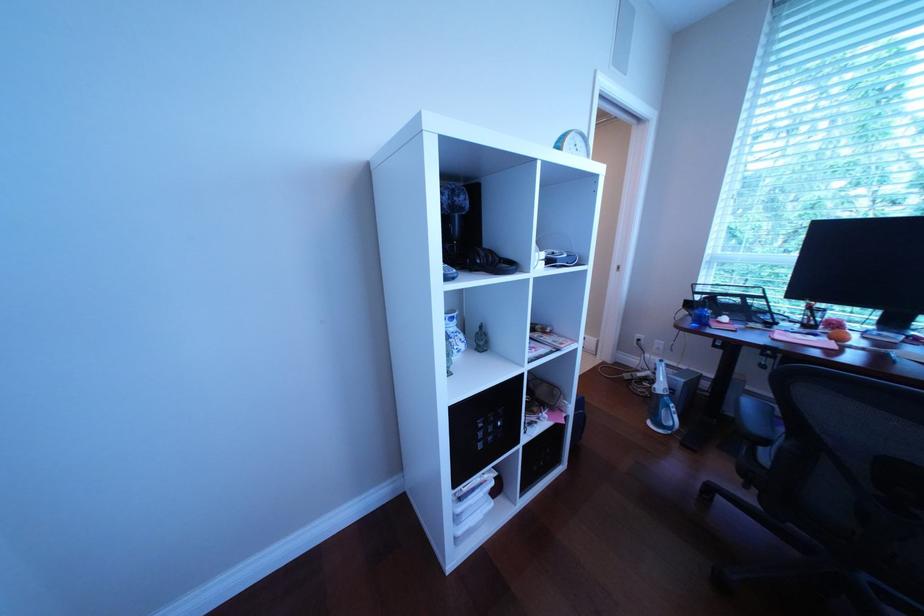
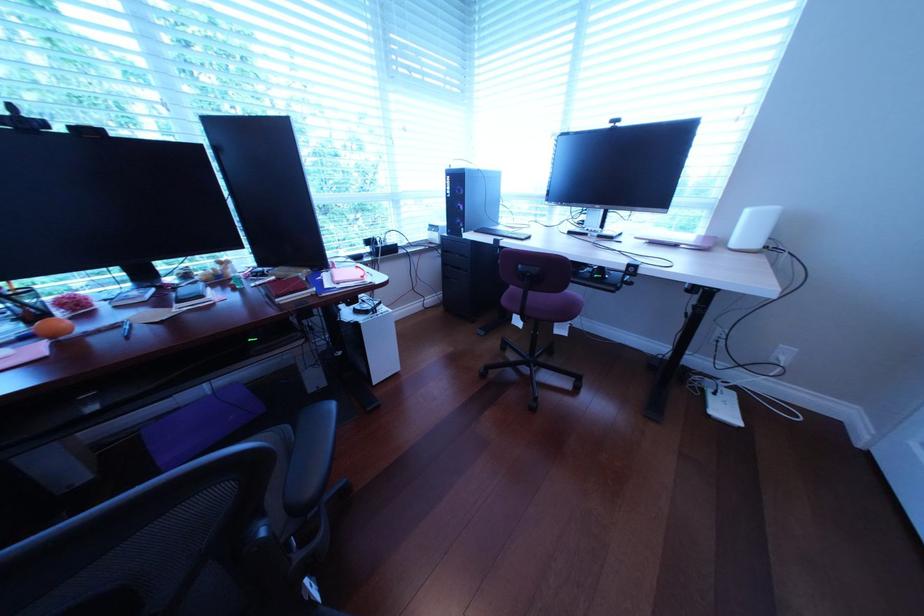
The first image is from the beginning of the video and the second image is from the end. How did the camera likely rotate when shooting the video?

The rotation direction of the camera is right-down.